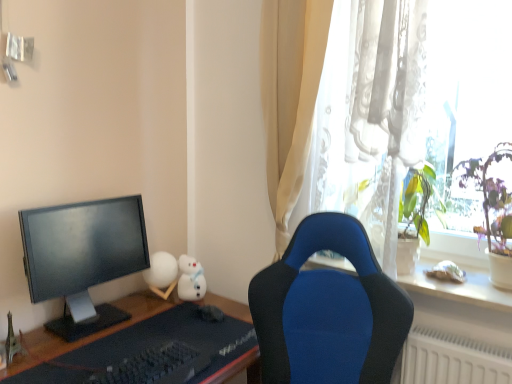
Question: From a real-world perspective, is matte black monitor at left physically below metallic silver eiffel tower at lower left, which is counted as the 4th toy, starting from the back?

Choices:
 (A) no
 (B) yes

Answer: (A)

Question: Can you confirm if matte black monitor at left is positioned to the left of metallic silver eiffel tower at lower left, arranged as the 1th toy when viewed from the left?

Choices:
 (A) yes
 (B) no

Answer: (B)

Question: Is the depth of matte black monitor at left less than that of metallic silver eiffel tower at lower left, placed as the 4th toy when sorted from right to left?

Choices:
 (A) no
 (B) yes

Answer: (B)

Question: Is metallic silver eiffel tower at lower left, placed as the 4th toy when sorted from right to left, completely or partially inside matte black monitor at left?

Choices:
 (A) yes
 (B) no

Answer: (B)

Question: Is matte black monitor at left bigger than metallic silver eiffel tower at lower left, positioned as the first toy in front-to-back order?

Choices:
 (A) yes
 (B) no

Answer: (A)

Question: Considering the relative sizes of matte black monitor at left and metallic silver eiffel tower at lower left, arranged as the 1th toy when viewed from the left, in the image provided, is matte black monitor at left smaller than metallic silver eiffel tower at lower left, arranged as the 1th toy when viewed from the left,?

Choices:
 (A) no
 (B) yes

Answer: (A)

Question: Is black matte keyboard at lower center positioned with its back to white plush toy at upper right, which is the 1th toy in right-to-left order?

Choices:
 (A) yes
 (B) no

Answer: (B)

Question: Is black matte keyboard at lower center smaller than white plush toy at upper right, the fourth toy in the left-to-right sequence?

Choices:
 (A) no
 (B) yes

Answer: (A)

Question: Does black matte keyboard at lower center have a greater width compared to white plush toy at upper right, the fourth toy in the left-to-right sequence?

Choices:
 (A) yes
 (B) no

Answer: (A)

Question: Is black matte keyboard at lower center bigger than white plush toy at upper right, the second toy in the front-to-back sequence?

Choices:
 (A) yes
 (B) no

Answer: (A)

Question: Is black matte keyboard at lower center at the right side of white plush toy at upper right, the second toy in the front-to-back sequence?

Choices:
 (A) no
 (B) yes

Answer: (A)

Question: From a real-world perspective, is black matte keyboard at lower center on white plush toy at upper right, the third toy viewed from the back?

Choices:
 (A) yes
 (B) no

Answer: (B)

Question: Are white plush toy at upper right, the second toy in the front-to-back sequence, and metallic silver eiffel tower at lower left, placed as the 4th toy when sorted from right to left, beside each other?

Choices:
 (A) no
 (B) yes

Answer: (A)